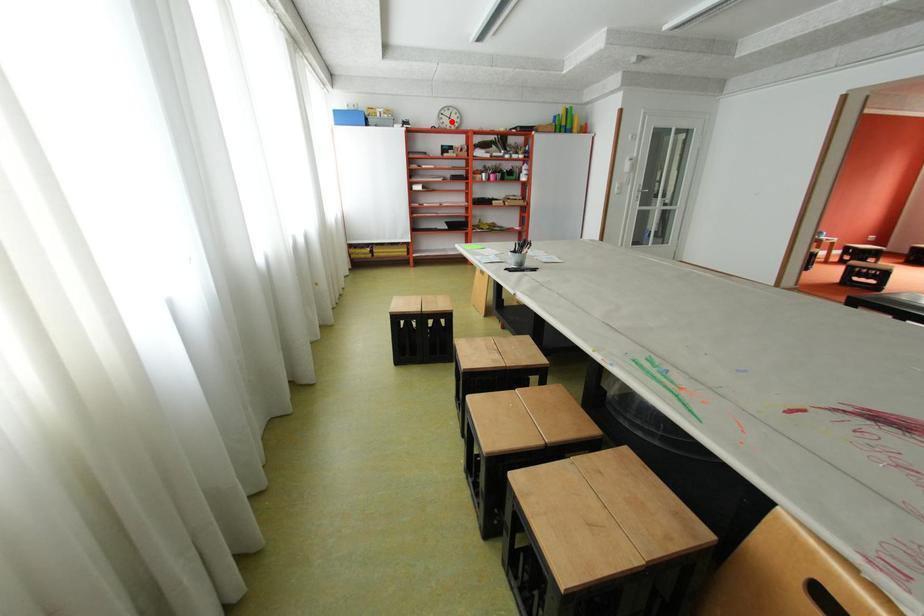
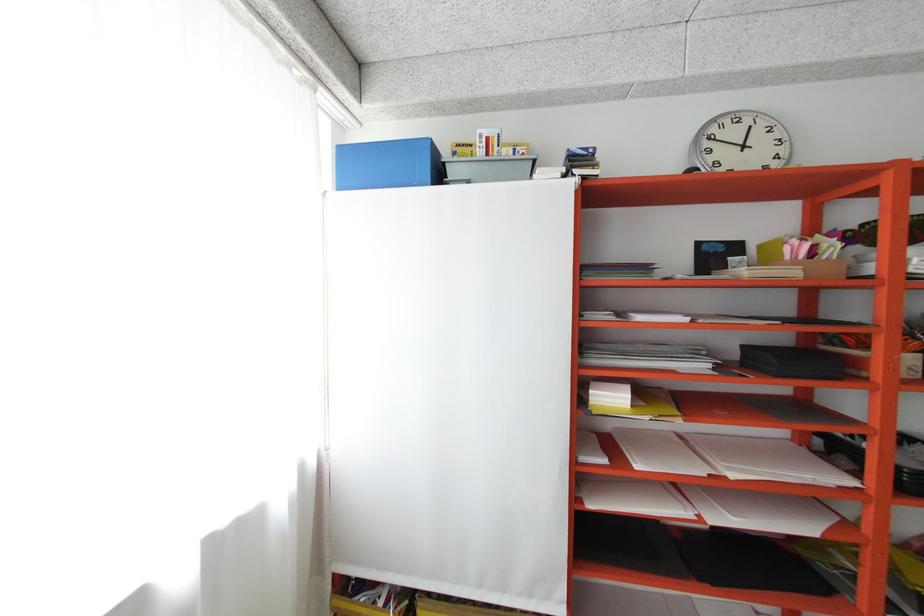
Find the pixel in the second image that matches the highlighted location in the first image.

(720, 159)